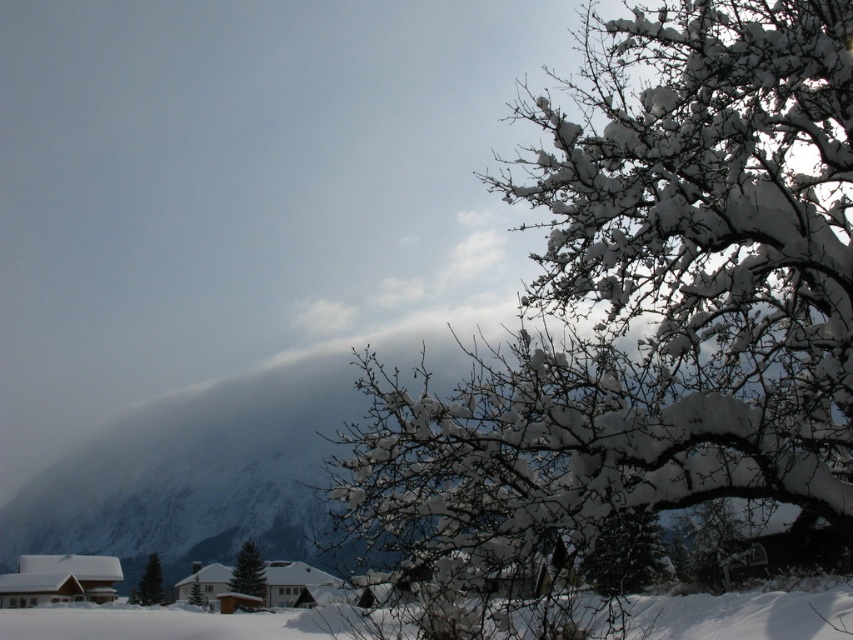
Question: Which of the following is the closest to the observer?

Choices:
 (A) snow-covered branches at upper right
 (B) green matte evergreen tree at lower center

Answer: (A)

Question: Where is green matte evergreen tree at lower center located in relation to green matte tree at lower left in the image?

Choices:
 (A) below
 (B) above

Answer: (B)

Question: Which point is farther to the camera?

Choices:
 (A) (244, 554)
 (B) (190, 600)
 (C) (369, 449)
 (D) (151, 598)

Answer: (A)

Question: Based on their relative distances, which object is nearer to the green matte tree at lower center?

Choices:
 (A) snow-covered branches at upper right
 (B) green matte evergreen tree at lower center
 (C) green matte tree at lower left

Answer: (B)

Question: Does snow-covered branches at upper right have a larger size compared to green matte tree at lower center?

Choices:
 (A) yes
 (B) no

Answer: (A)

Question: In this image, where is snow-covered branches at upper right located relative to green matte evergreen tree at lower center?

Choices:
 (A) left
 (B) right

Answer: (B)